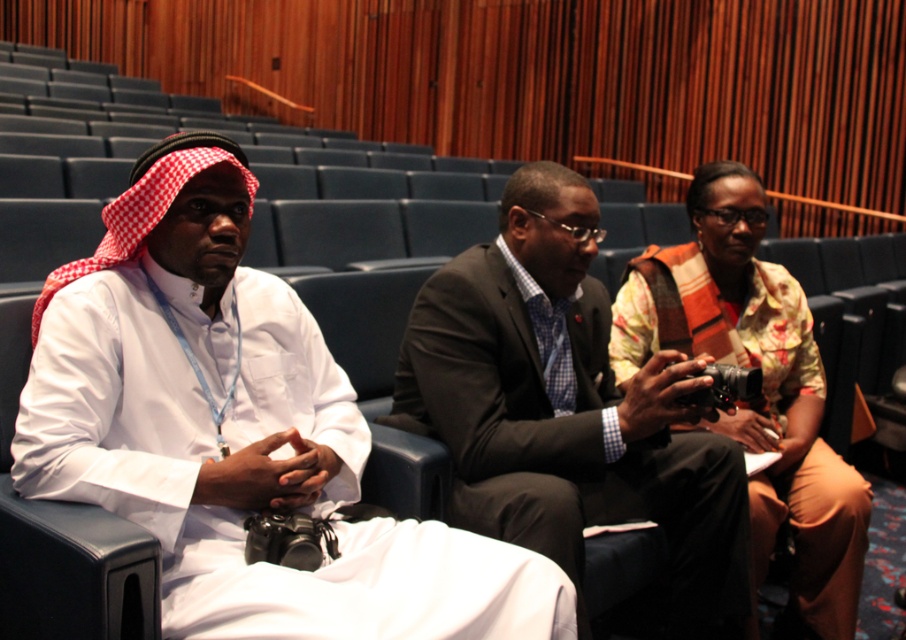
You are an event organizer who needs to adjust seating arrangements. You notice the white cloth at left and the dark brown suit at center. Which object is positioned higher in the image?

The white cloth at left is located above the dark brown suit at center, so it is positioned higher in the image.

You are standing in the conference hall and want to place a small potted plant between the two points, point [416,346] and point [796,465]. Which point should the plant be closer to in order to be nearer to the front of the hall?

The plant should be placed closer to point [416,346] because it is closer to the viewer than point [796,465].

You are organizing a photo shoot and need to ensure that the two central figures in the image are positioned such that their clothing items do not overlap. Given the sizes of the dark brown suit at center and the floral cotton robe at center, which clothing item should be placed farther back to prevent overlap?

The dark brown suit at center is bigger than the floral cotton robe at center, so placing the dark brown suit at center farther back would help prevent overlap between the two clothing items.